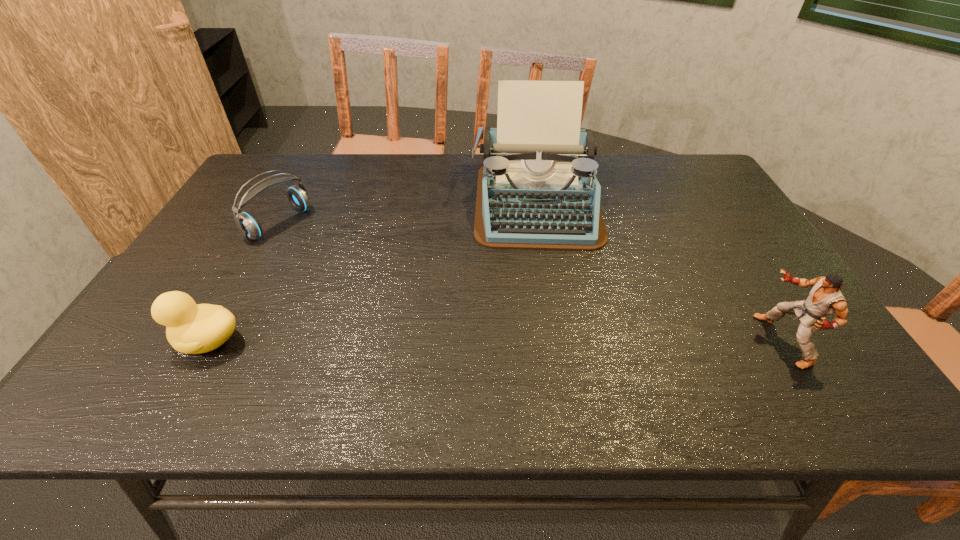
Locate an element on the screen. duck is located at coordinates (191, 328).

Where is `puncher`? puncher is located at coordinates [x=825, y=298].

The image size is (960, 540). I want to click on the rightmost object, so click(x=825, y=298).

Identify the location of headset. This screenshot has height=540, width=960. (249, 227).

In order to click on the third object from left to right in this screenshot , I will do (x=537, y=190).

In order to click on the tallest object in this screenshot , I will do `click(537, 190)`.

This screenshot has height=540, width=960. Identify the location of free space located 0.080m on the front-facing side of the duck. (137, 341).

Where is `vacant position located 0.260m on the front-facing side of the second tallest object`? vacant position located 0.260m on the front-facing side of the second tallest object is located at coordinates pos(644,341).

The height and width of the screenshot is (540, 960). I want to click on vacant region located 0.390m on the front-facing side of the second tallest object, so click(586, 341).

Where is `vacant point located on the front-facing side of the second tallest object`? The height and width of the screenshot is (540, 960). vacant point located on the front-facing side of the second tallest object is located at coordinates click(604, 341).